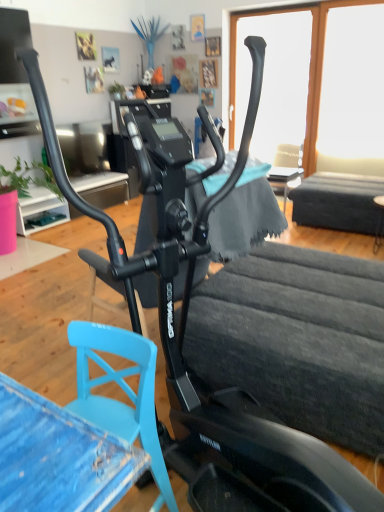
Question: Based on their sizes in the image, would you say black matte table at lower right, the second table from the back, is bigger or smaller than soft blue cloth at center?

Choices:
 (A) small
 (B) big

Answer: (A)

Question: Is point (380, 227) closer or farther from the camera than point (228, 203)?

Choices:
 (A) closer
 (B) farther

Answer: (B)

Question: Estimate the real-world distances between objects in this image. Which object is farther from the blue painted wood swivel chair at lower left?

Choices:
 (A) soft blue cloth at center
 (B) transparent glass window at upper center, arranged as the 2th window screen when viewed from the right
 (C) smooth wooden table at right, the 1th table when ordered from back to front
 (D) black matte table at lower right, which is counted as the 1th table, starting from the front
 (E) transparent glass window at upper right, which is the first window screen in right-to-left order

Answer: (E)

Question: Based on their relative distances, which object is farther from the transparent glass window at upper center, which appears as the first window screen when viewed from the left?

Choices:
 (A) blue painted wood swivel chair at lower left
 (B) transparent glass window at upper right, the second window screen viewed from the left
 (C) soft blue cloth at center
 (D) smooth wooden table at right, the 1th table when ordered from back to front
 (E) black matte table at lower right, the second table from the back

Answer: (A)